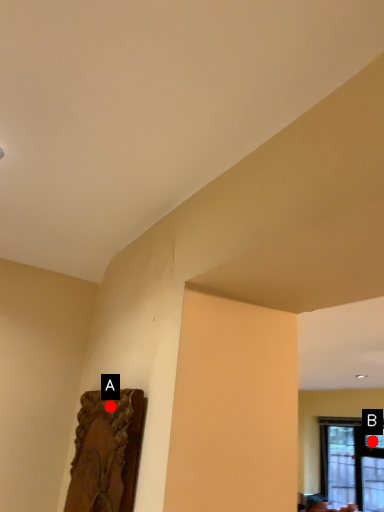
Question: Two points are circled on the image, labeled by A and B beside each circle. Which point is farther to the camera?

Choices:
 (A) A is further
 (B) B is further

Answer: (B)